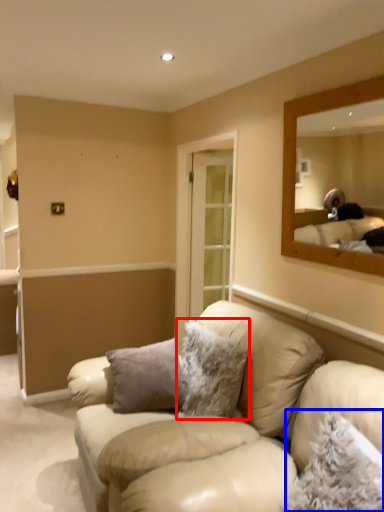
Question: Which object appears farthest to the camera in this image, pillow (highlighted by a red box) or pillow (highlighted by a blue box)?

Choices:
 (A) pillow
 (B) pillow

Answer: (A)